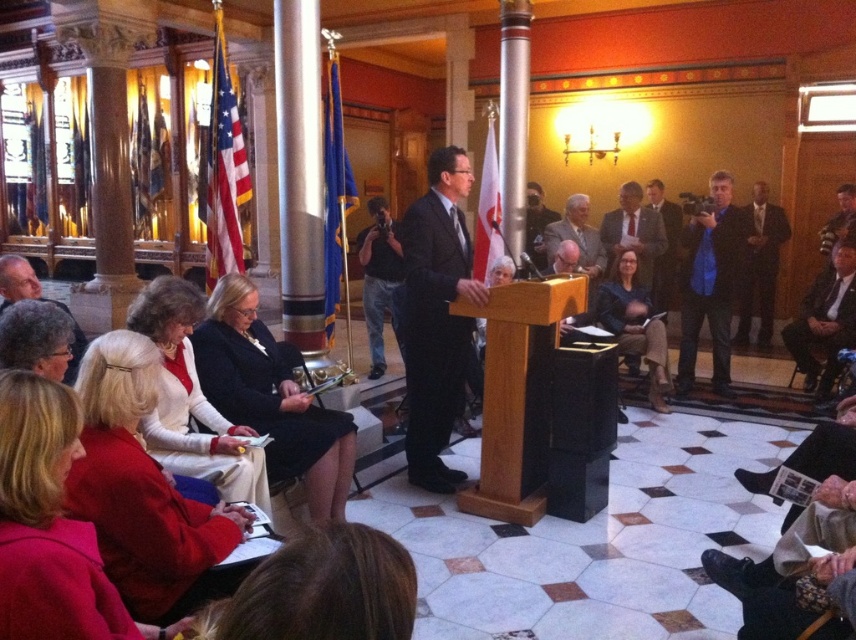
Question: Which is farther from the dark gray suit at right?

Choices:
 (A) matte red sweater at lower left
 (B) gray hair at lower left
 (C) black fabric dress at center

Answer: (A)

Question: Which point is closer to the camera taking this photo?

Choices:
 (A) (90, 372)
 (B) (221, 355)

Answer: (A)

Question: Does white fabric dress at lower left come in front of blue fabric bag at right?

Choices:
 (A) no
 (B) yes

Answer: (B)

Question: Does black cotton shirt at center have a greater width compared to dark gray suit at right?

Choices:
 (A) yes
 (B) no

Answer: (A)

Question: Is blue fabric bag at right thinner than dark gray suit at right?

Choices:
 (A) yes
 (B) no

Answer: (B)

Question: Which object appears farthest from the camera in this image?

Choices:
 (A) black fabric dress at center
 (B) matte red sweater at lower left
 (C) matte black suit at upper right
 (D) dark suit jacket at right

Answer: (D)